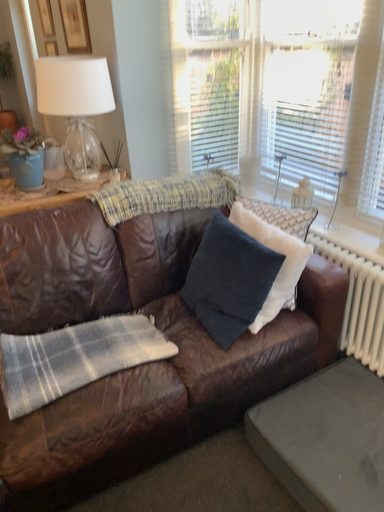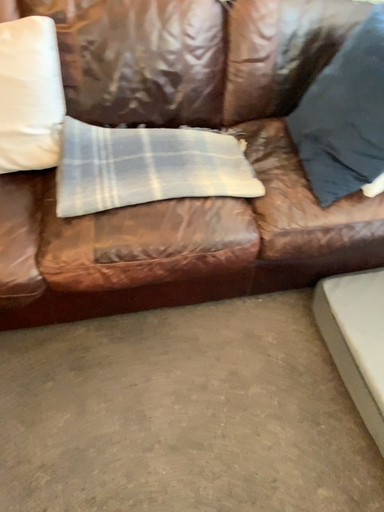
Question: Which way did the camera rotate in the video?

Choices:
 (A) rotated downward
 (B) rotated upward

Answer: (A)